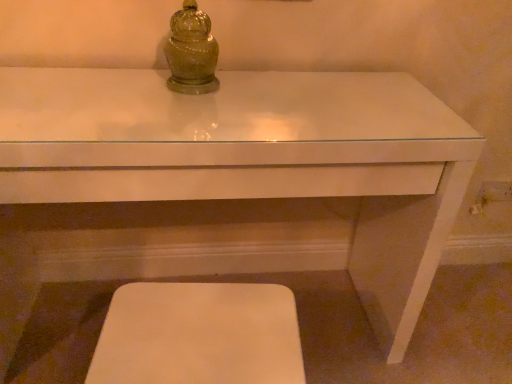
Question: Considering the relative sizes of white matte step stool at lower center and white glossy table at center in the image provided, is white matte step stool at lower center thinner than white glossy table at center?

Choices:
 (A) yes
 (B) no

Answer: (A)

Question: Considering the relative positions of white matte step stool at lower center and white glossy table at center in the image provided, is white matte step stool at lower center behind white glossy table at center?

Choices:
 (A) yes
 (B) no

Answer: (B)

Question: Does white matte step stool at lower center have a larger size compared to white glossy table at center?

Choices:
 (A) no
 (B) yes

Answer: (A)

Question: Is white matte step stool at lower center wider than white glossy table at center?

Choices:
 (A) yes
 (B) no

Answer: (B)

Question: Can you confirm if white matte step stool at lower center is positioned to the left of white glossy table at center?

Choices:
 (A) no
 (B) yes

Answer: (A)

Question: Looking at the image, does white matte step stool at lower center seem bigger or smaller compared to green glass jar at upper center?

Choices:
 (A) big
 (B) small

Answer: (A)

Question: Is white matte step stool at lower center in front of or behind green glass jar at upper center in the image?

Choices:
 (A) front
 (B) behind

Answer: (A)

Question: Considering the positions of white matte step stool at lower center and green glass jar at upper center in the image, is white matte step stool at lower center wider or thinner than green glass jar at upper center?

Choices:
 (A) wide
 (B) thin

Answer: (A)

Question: From their relative heights in the image, would you say white matte step stool at lower center is taller or shorter than green glass jar at upper center?

Choices:
 (A) tall
 (B) short

Answer: (A)

Question: Based on their sizes in the image, would you say green glass jar at upper center is bigger or smaller than white matte step stool at lower center?

Choices:
 (A) big
 (B) small

Answer: (B)

Question: Is green glass jar at upper center inside the boundaries of white matte step stool at lower center, or outside?

Choices:
 (A) outside
 (B) inside

Answer: (A)

Question: Visually, is green glass jar at upper center positioned to the left or to the right of white matte step stool at lower center?

Choices:
 (A) right
 (B) left

Answer: (B)

Question: In the image, is green glass jar at upper center positioned in front of or behind white matte step stool at lower center?

Choices:
 (A) behind
 (B) front

Answer: (A)

Question: Based on their positions, is white glossy table at center located to the left or right of white matte step stool at lower center?

Choices:
 (A) right
 (B) left

Answer: (B)

Question: Based on their sizes in the image, would you say white glossy table at center is bigger or smaller than white matte step stool at lower center?

Choices:
 (A) big
 (B) small

Answer: (A)